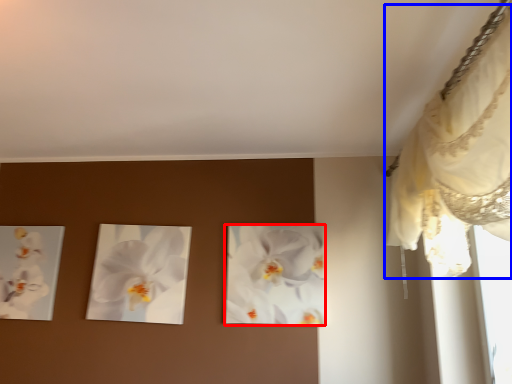
Question: Which object appears closest to the camera in this image, flower (highlighted by a red box) or curtain (highlighted by a blue box)?

Choices:
 (A) flower
 (B) curtain

Answer: (B)